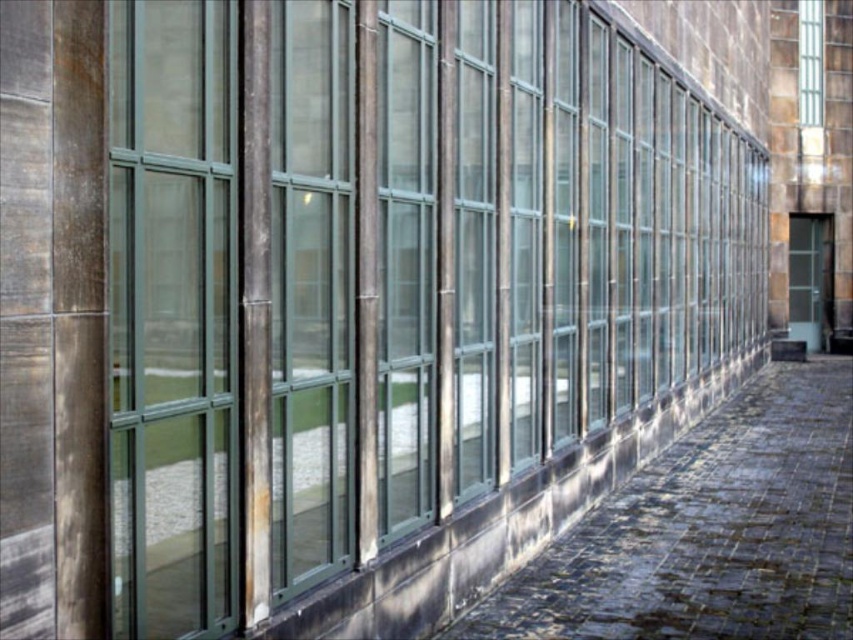
Does dark gray cobblestone at center have a smaller size compared to clear glass door at right?

No, dark gray cobblestone at center is not smaller than clear glass door at right.

Can you confirm if dark gray cobblestone at center is wider than clear glass door at right?

Indeed, dark gray cobblestone at center has a greater width compared to clear glass door at right.

Image resolution: width=853 pixels, height=640 pixels. In order to click on dark gray cobblestone at center in this screenshot , I will do `click(708, 531)`.